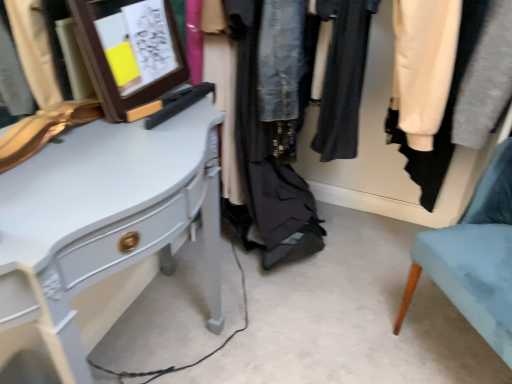
What are the coordinates of `free space above white glossy desk at left (from a real-world perspective)` in the screenshot? It's located at (101, 142).